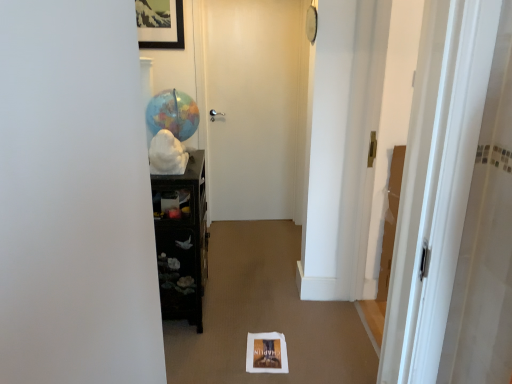
Question: Is point (236, 67) closer or farther from the camera than point (159, 43)?

Choices:
 (A) closer
 (B) farther

Answer: (B)

Question: Considering the positions of white matte door at center, which is the second door in front-to-back order, and wooden framed picture at upper center in the image, is white matte door at center, which is the second door in front-to-back order, taller or shorter than wooden framed picture at upper center?

Choices:
 (A) tall
 (B) short

Answer: (A)

Question: Which object is positioned closest to the white matte door at center, marked as the first door in a left-to-right arrangement?

Choices:
 (A) wooden framed picture at upper center
 (B) black glossy cabinet at left
 (C) white glossy door at right, the 2th door when ordered from back to front
 (D) matte globe at center

Answer: (A)

Question: Considering the real-world distances, which object is farthest from the matte globe at center?

Choices:
 (A) wooden framed picture at upper center
 (B) white matte door at center, the second door when ordered from right to left
 (C) white glossy door at right, the 2th door when ordered from back to front
 (D) black glossy cabinet at left

Answer: (C)